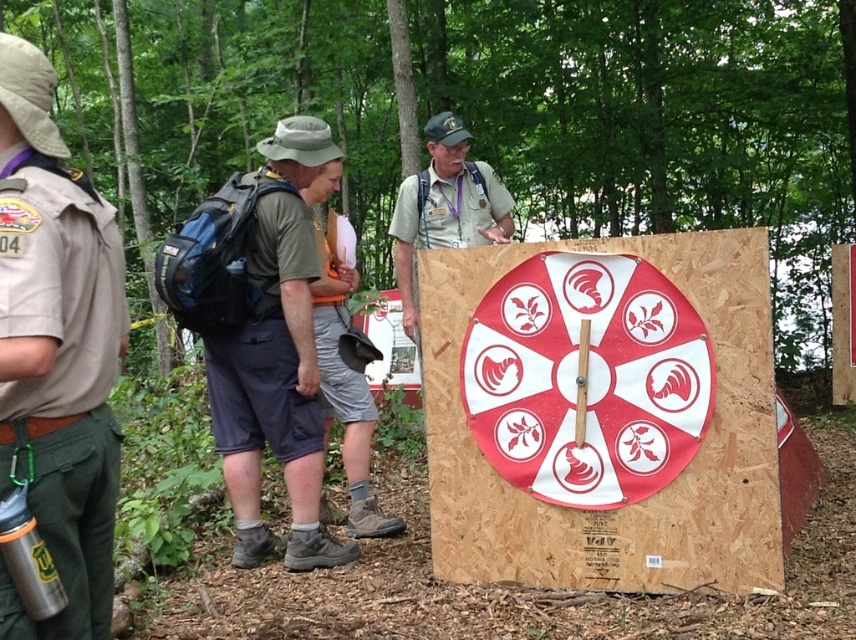
In the scene shown: You are standing at the point with coordinates point (x=275, y=269) and want to walk towards the point (x=676, y=308). Which direction should you move?

You should move forward because point (x=676, y=308) is in front of point (x=275, y=269).

You are standing in the forest and looking at the target board. There are two points marked on it. Which point is closer to you, point (171, 216) or point (293, 348)?

Point (171, 216) is closer to you than point (293, 348) because it is further to the viewer.